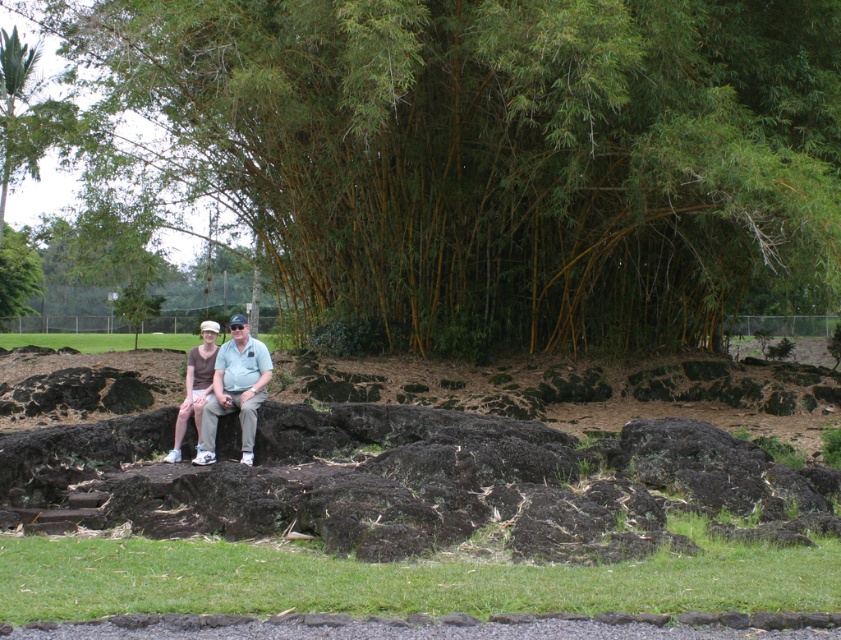
You are planning to take a photo of the green bamboo at upper center and the matte green shirt at center. Which object should you focus on first if you want to ensure both are in sharp focus?

The green bamboo at upper center is bigger than the matte green shirt at center, so focusing on the green bamboo at upper center first would help ensure both are in sharp focus since it is larger and easier to lock focus on.

You are planning to set up a small tent between the green bamboo at upper center and the rough stone bench at center. Considering their heights, which object will block more sunlight for the tent?

The green bamboo at upper center will block more sunlight for the tent since it has a greater height compared to the rough stone bench at center.